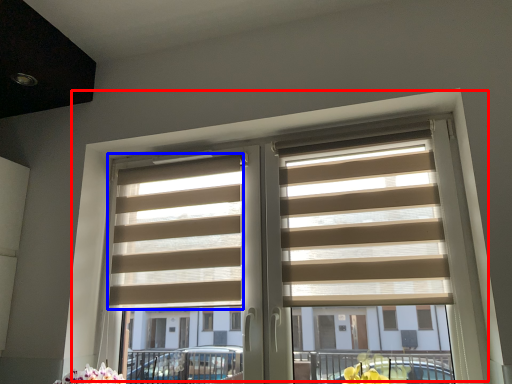
Question: Which of the following is the closest to the observer, window (highlighted by a red box) or blind (highlighted by a blue box)?

Choices:
 (A) window
 (B) blind

Answer: (A)